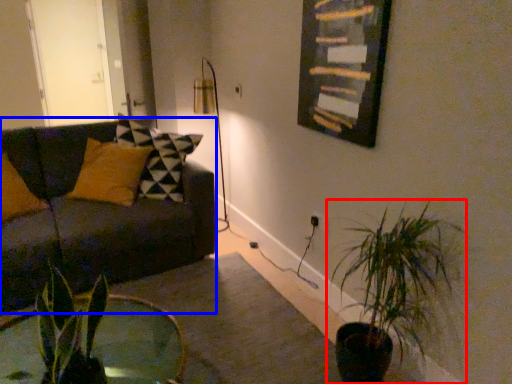
Question: Which of the following is the closest to the observer, houseplant (highlighted by a red box) or studio couch (highlighted by a blue box)?

Choices:
 (A) houseplant
 (B) studio couch

Answer: (A)